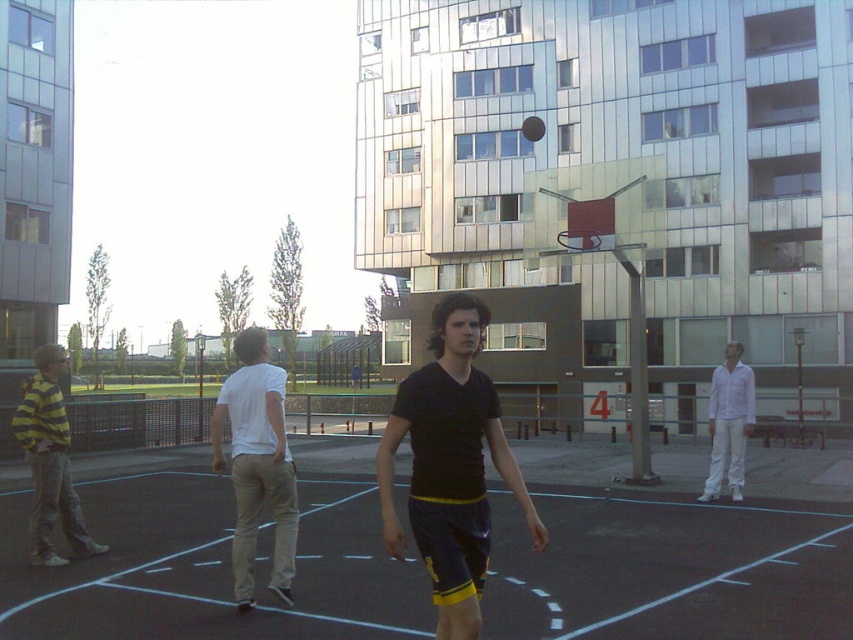
Question: Which of these objects is positioned farthest from the black matte shorts at center?

Choices:
 (A) white cotton shirt at center
 (B) yellow striped hoodie at left

Answer: (B)

Question: Which object is the farthest from the black matte shorts at center?

Choices:
 (A) shiny black basketball at center
 (B) white cotton shirt at right
 (C) yellow striped hoodie at left

Answer: (A)

Question: Can you confirm if white cotton shirt at center is positioned below shiny black basketball at center?

Choices:
 (A) no
 (B) yes

Answer: (B)

Question: Does black matte shorts at center appear over white cotton shirt at center?

Choices:
 (A) no
 (B) yes

Answer: (B)

Question: In this image, where is black rubber basketball court at center located relative to white cotton shirt at right?

Choices:
 (A) below
 (B) above

Answer: (A)

Question: Among these points, which one is nearest to the camera?

Choices:
 (A) (421, 460)
 (B) (531, 138)
 (C) (729, 371)

Answer: (A)